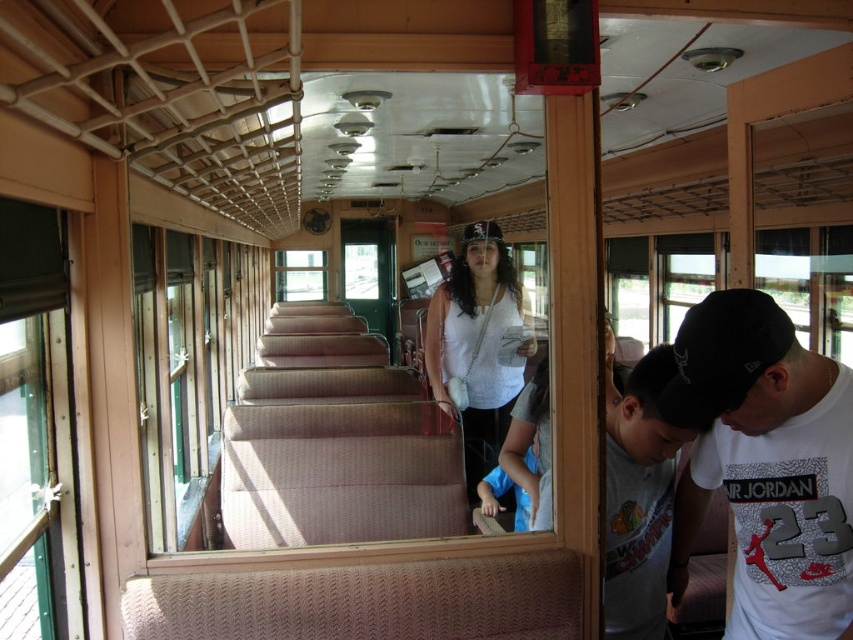
Who is higher up, white cotton t-shirt at lower right or white matte tank top at center?

white cotton t-shirt at lower right

Who is positioned more to the left, white cotton t-shirt at lower right or white matte tank top at center?

white matte tank top at center is more to the left.

Does point (711, 458) come closer to viewer compared to point (502, 417)?

Yes, it is in front of point (502, 417).

Identify the location of white cotton t-shirt at lower right. (766, 465).